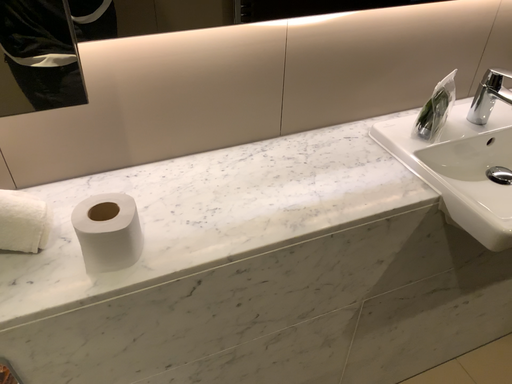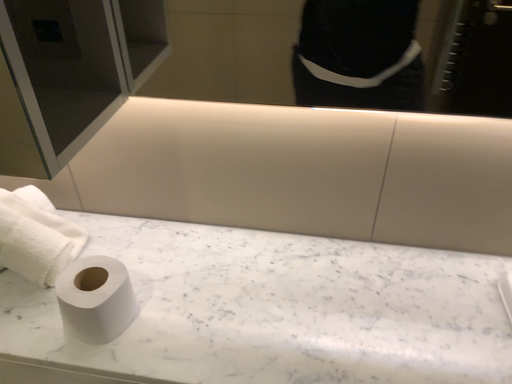
Question: Which way did the camera rotate in the video?

Choices:
 (A) rotated right
 (B) rotated left

Answer: (B)